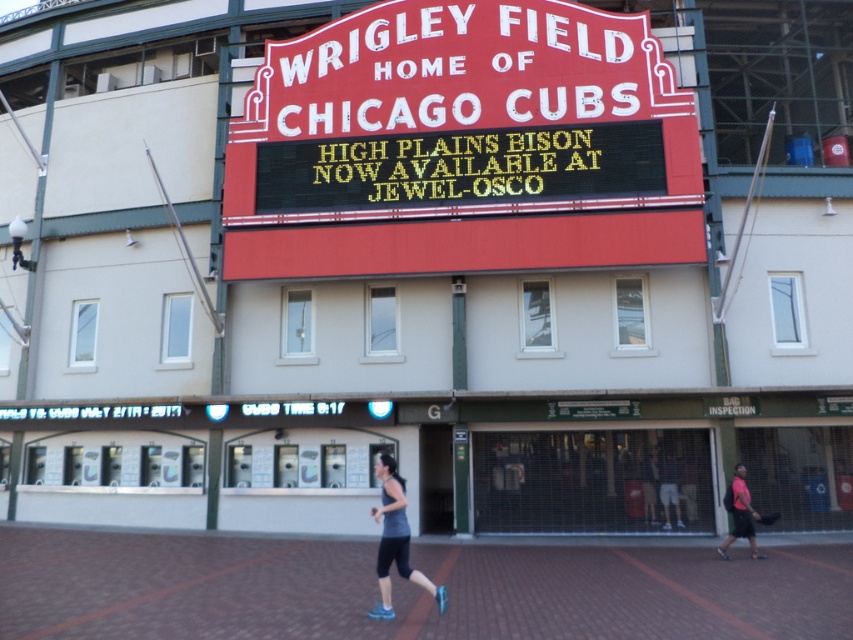
Describe the element at coordinates (395, 540) in the screenshot. I see `gray fabric tank top at center` at that location.

Who is positioned more to the left, gray fabric tank top at center or pink fabric shorts at lower right?

gray fabric tank top at center is more to the left.

The image size is (853, 640). I want to click on gray fabric tank top at center, so click(x=395, y=540).

Image resolution: width=853 pixels, height=640 pixels. I want to click on gray fabric tank top at center, so click(395, 540).

Is black electronic display at center to the left of gray fabric tank top at center from the viewer's perspective?

In fact, black electronic display at center is to the right of gray fabric tank top at center.

Between black electronic display at center and gray fabric tank top at center, which one appears on the right side from the viewer's perspective?

black electronic display at center

Does point (370, 161) come behind point (401, 552)?

Yes, point (370, 161) is farther from viewer.

At what (x,y) coordinates should I click in order to perform the action: click on black electronic display at center. Please return your answer as a coordinate pair (x, y). The width and height of the screenshot is (853, 640). Looking at the image, I should click on (461, 168).

From the picture: Who is shorter, black electronic display at center or pink fabric shorts at lower right?

black electronic display at center is shorter.

The height and width of the screenshot is (640, 853). In order to click on black electronic display at center in this screenshot , I will do `click(461, 168)`.